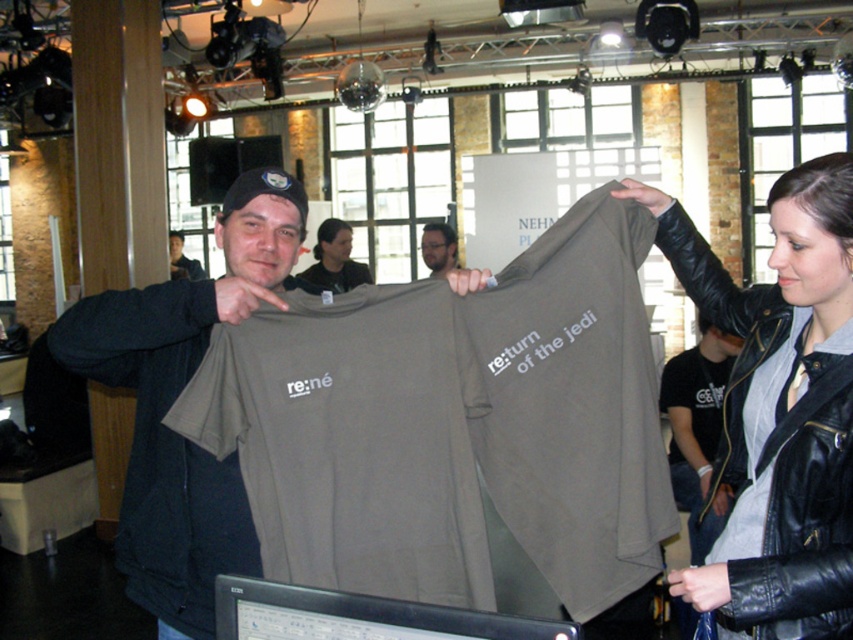
Question: Estimate the real-world distances between objects in this image. Which object is farther from the dark gray t-shirt at center?

Choices:
 (A) matte black t-shirt at center
 (B) dark gray leather jacket at center
 (C) matte gray t-shirt at center

Answer: (B)

Question: Considering the real-world distances, which object is closest to the dark gray t-shirt at center?

Choices:
 (A) matte black t-shirt at center
 (B) matte gray t-shirt at center
 (C) black leather jacket at upper right

Answer: (A)

Question: Can you confirm if dark gray t-shirt at center is positioned above matte black t-shirt at center?

Choices:
 (A) no
 (B) yes

Answer: (A)

Question: Is matte olive green t-shirt at center to the left of dark gray t-shirt at center from the viewer's perspective?

Choices:
 (A) no
 (B) yes

Answer: (A)

Question: Can you confirm if matte gray t-shirt at center is positioned to the right of dark gray t-shirt at center?

Choices:
 (A) yes
 (B) no

Answer: (A)

Question: Among these objects, which one is farthest from the camera?

Choices:
 (A) matte black t-shirt at center
 (B) dark gray t-shirt at center

Answer: (A)